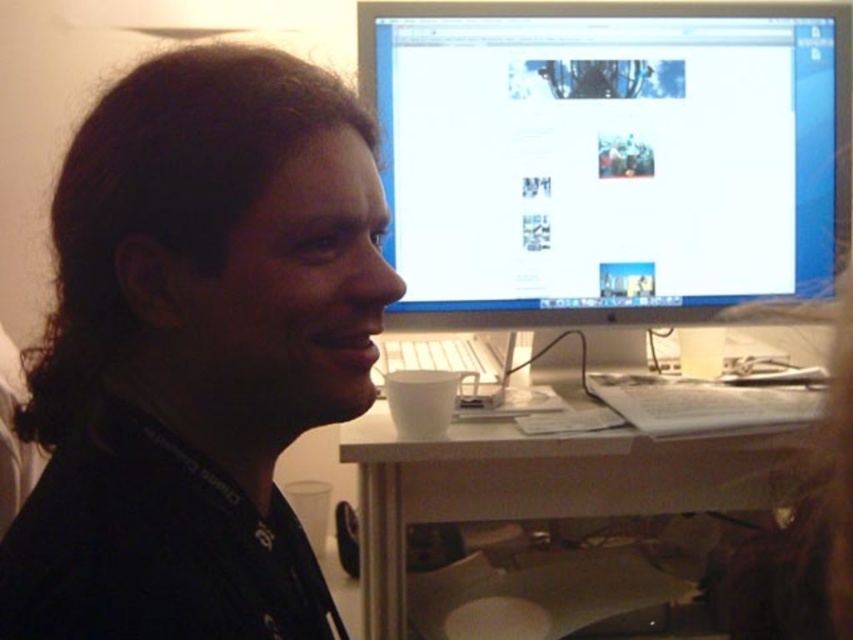
From the picture: Is black matte shirt at center closer to camera compared to matte black monitor at upper right?

That is True.

Identify the location of black matte shirt at center. Image resolution: width=853 pixels, height=640 pixels. click(x=196, y=352).

Can you confirm if matte black monitor at upper right is thinner than white plastic desk at lower center?

Incorrect, matte black monitor at upper right's width is not less than white plastic desk at lower center's.

Between point (526, 252) and point (447, 456), which one is positioned behind?

The point (526, 252) is more distant.

Find the location of a particular element. The image size is (853, 640). matte black monitor at upper right is located at coordinates [607, 156].

Is black matte shirt at center thinner than white plastic desk at lower center?

Correct, black matte shirt at center's width is less than white plastic desk at lower center's.

Between point (231, 54) and point (573, 513), which one is positioned in front?

Point (231, 54) is more forward.

The image size is (853, 640). I want to click on black matte shirt at center, so click(x=196, y=352).